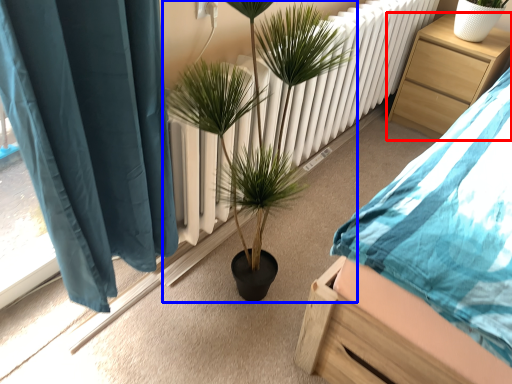
Question: Among these objects, which one is farthest to the camera, nightstand (highlighted by a red box) or houseplant (highlighted by a blue box)?

Choices:
 (A) nightstand
 (B) houseplant

Answer: (A)